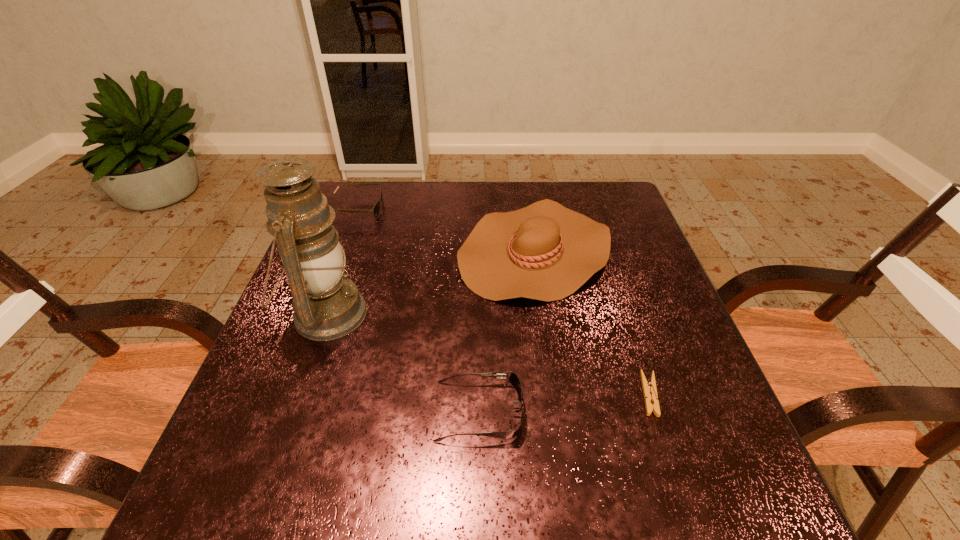
In order to click on the tallest object in this screenshot , I will do `click(327, 306)`.

I want to click on the fourth shortest object, so click(x=545, y=251).

Where is `the left sunglasses`? The image size is (960, 540). the left sunglasses is located at coordinates (375, 210).

Locate an element on the screen. The image size is (960, 540). the shorter sunglasses is located at coordinates 511,377.

This screenshot has width=960, height=540. What are the coordinates of `the right sunglasses` in the screenshot? It's located at (511, 377).

Identify the location of the shortest object. (649, 388).

In order to click on vacant position located on the right of the oil lamp in this screenshot , I will do (x=480, y=314).

Where is `blank space located 0.140m on the left of the cowboy hat`? blank space located 0.140m on the left of the cowboy hat is located at coordinates click(x=406, y=251).

You are a GUI agent. You are given a task and a screenshot of the screen. Output one action in this format:
    pyautogui.click(x=<x>, y=<y>)
    Task: Click on the free spot located on the lenses of the left sunglasses
    Image resolution: width=960 pixels, height=540 pixels.
    Given the screenshot: What is the action you would take?
    click(422, 208)

Where is `vacant space located 0.150m on the front-facing side of the nearer sunglasses`? The image size is (960, 540). vacant space located 0.150m on the front-facing side of the nearer sunglasses is located at coordinates pyautogui.click(x=604, y=411).